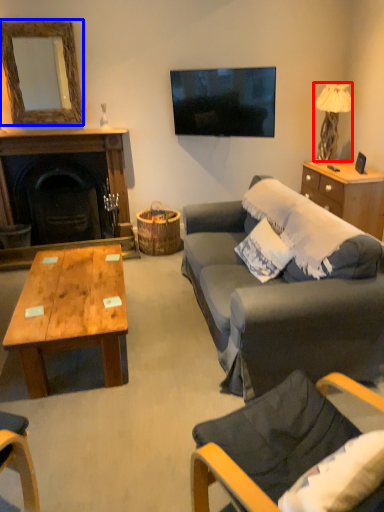
Question: Which point is closer to the camera, lamp (highlighted by a red box) or mirror (highlighted by a blue box)?

Choices:
 (A) lamp
 (B) mirror

Answer: (B)